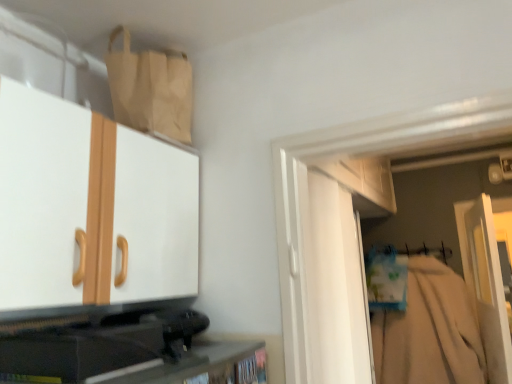
Where is `blank space situated above white fabric hanger at right (from a real-world perspective)`? Image resolution: width=512 pixels, height=384 pixels. blank space situated above white fabric hanger at right (from a real-world perspective) is located at coordinates pos(407,244).